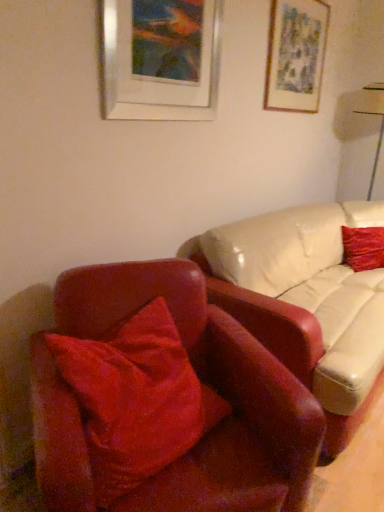
Question: Is matte gray picture frame at upper right, placed as the 2th picture frame when sorted from front to back, bigger or smaller than white glossy table lamp at upper right?

Choices:
 (A) small
 (B) big

Answer: (A)

Question: Considering the positions of matte gray picture frame at upper right, the second picture frame viewed from the left, and white glossy table lamp at upper right in the image, is matte gray picture frame at upper right, the second picture frame viewed from the left, wider or thinner than white glossy table lamp at upper right?

Choices:
 (A) thin
 (B) wide

Answer: (A)

Question: Which object is the closest to the matte gray picture frame at upper right, placed as the 2th picture frame when sorted from front to back?

Choices:
 (A) white glossy table lamp at upper right
 (B) metallic silver picture frame at upper center, which appears as the first picture frame when viewed from the left
 (C) velvet red pillow at left, which appears as the second pillow when viewed from the top
 (D) velvet red pillow at right, the second pillow from the left

Answer: (B)

Question: Estimate the real-world distances between objects in this image. Which object is farther from the velvet red pillow at left, the 2th pillow in the right-to-left sequence?

Choices:
 (A) white glossy table lamp at upper right
 (B) matte gray picture frame at upper right, placed as the 2th picture frame when sorted from front to back
 (C) velvet red pillow at right, the second pillow from the left
 (D) metallic silver picture frame at upper center, the second picture frame viewed from the right

Answer: (A)